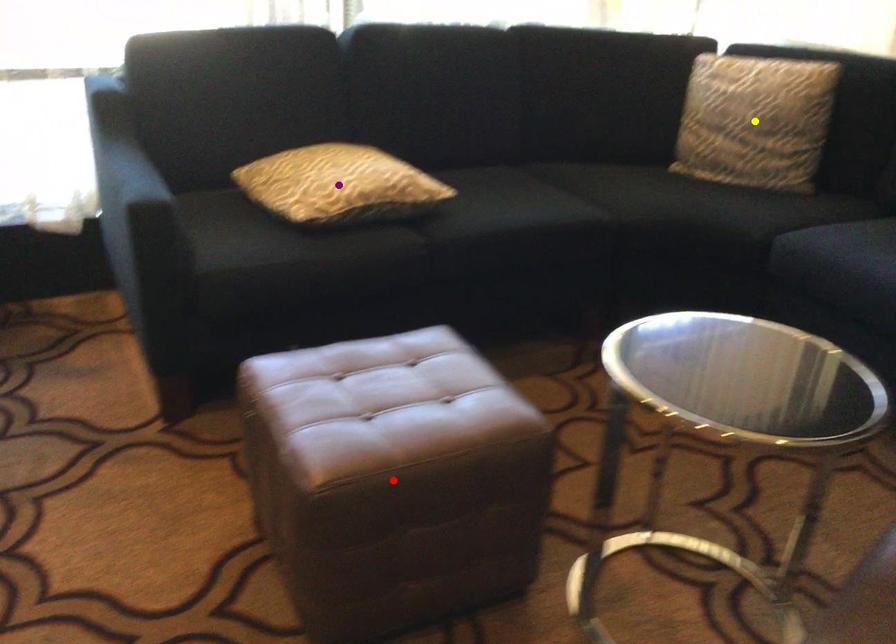
Order these from nearest to farthest:
A) purple point
B) red point
C) yellow point

red point, purple point, yellow point